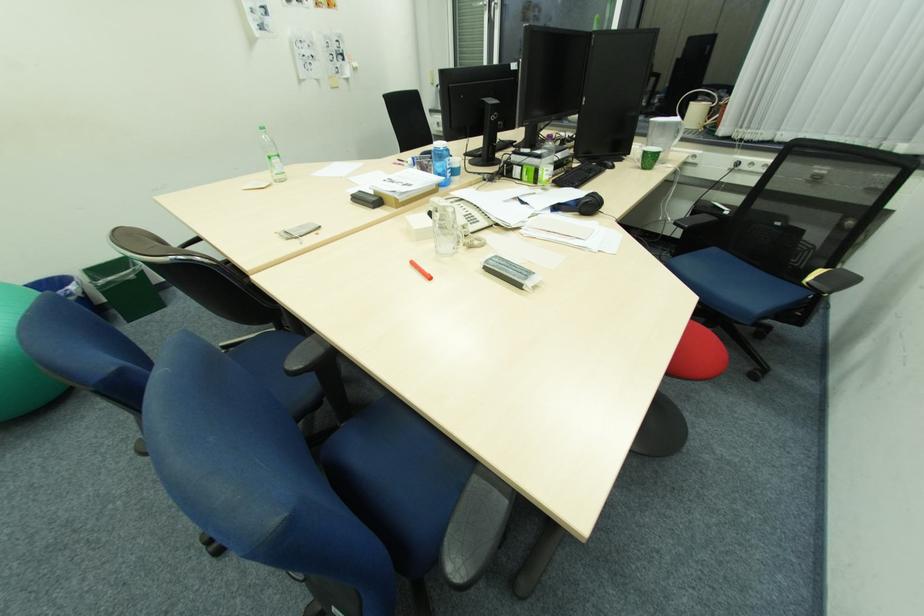
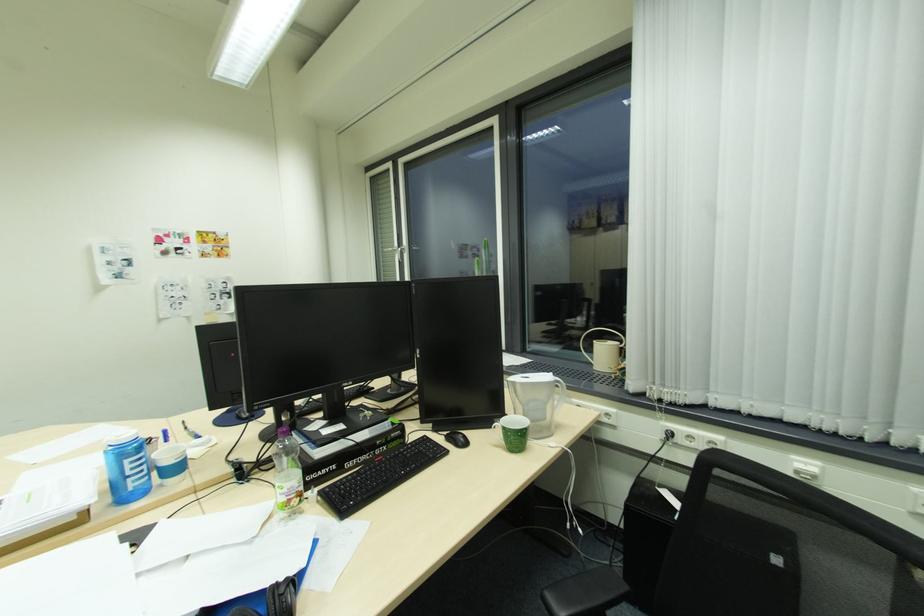
The point at (460, 179) is marked in the first image. Where is the corresponding point in the second image?

(176, 482)